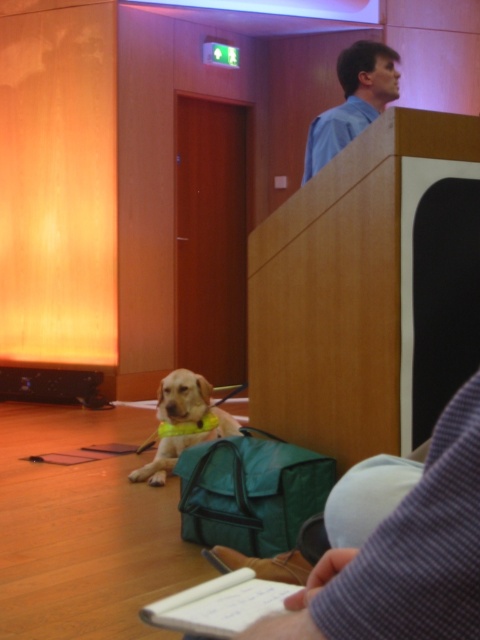
Question: Is blue shirt at upper center bigger than yellow fabric dog at lower left?

Choices:
 (A) yes
 (B) no

Answer: (B)

Question: Which is farther from the green fabric bag at lower center?

Choices:
 (A) yellow fabric dog at lower left
 (B) blue shirt at upper center

Answer: (B)

Question: Estimate the real-world distances between objects in this image. Which object is closer to the green fabric bag at lower center?

Choices:
 (A) yellow fabric dog at lower left
 (B) blue shirt at upper center

Answer: (A)

Question: Which object is the closest to the blue shirt at upper center?

Choices:
 (A) green fabric bag at lower center
 (B) yellow fabric dog at lower left

Answer: (A)

Question: Observing the image, what is the correct spatial positioning of blue shirt at upper center in reference to yellow fabric dog at lower left?

Choices:
 (A) above
 (B) below

Answer: (A)

Question: Can you confirm if blue shirt at upper center is bigger than yellow fabric dog at lower left?

Choices:
 (A) no
 (B) yes

Answer: (A)